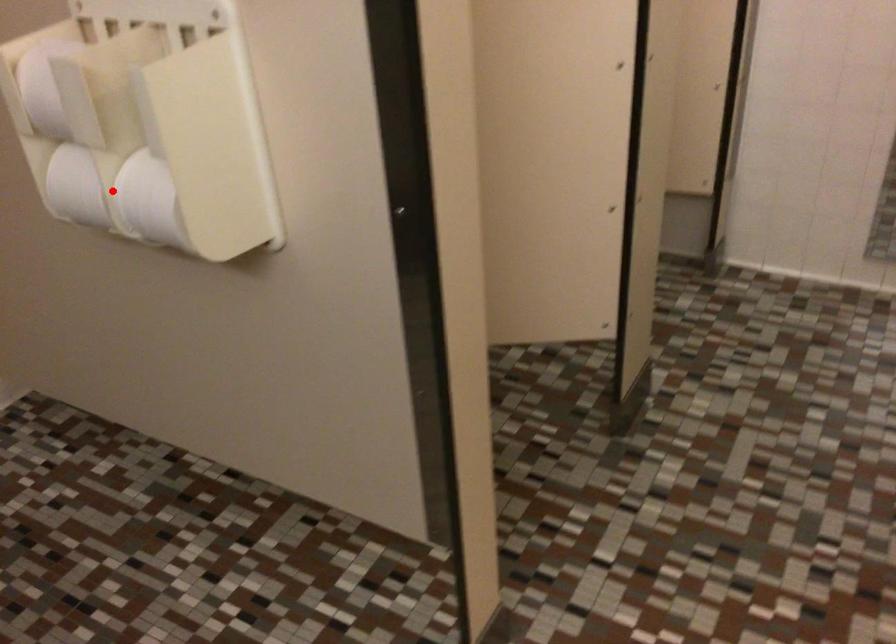
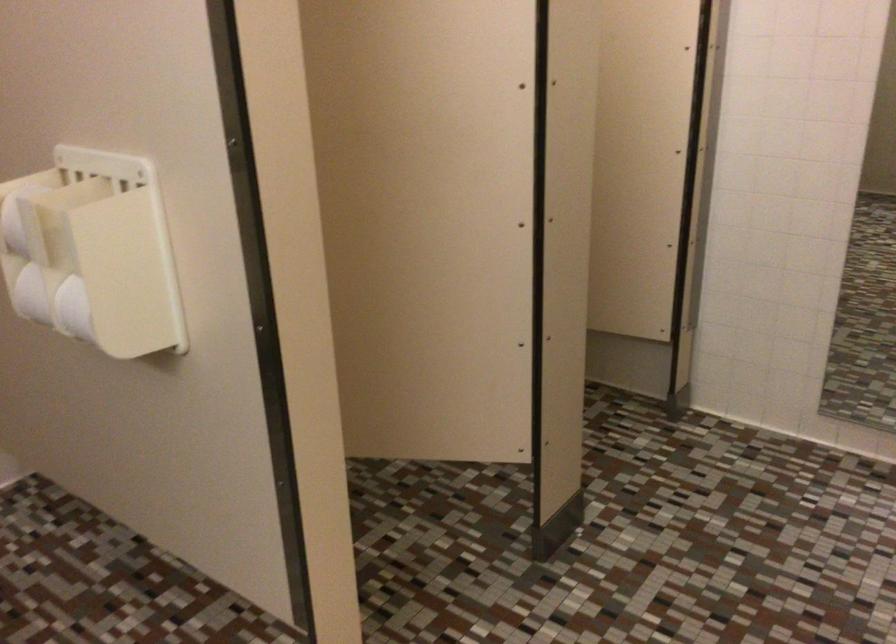
In the second image, find the point that corresponds to the highlighted location in the first image.

(53, 303)